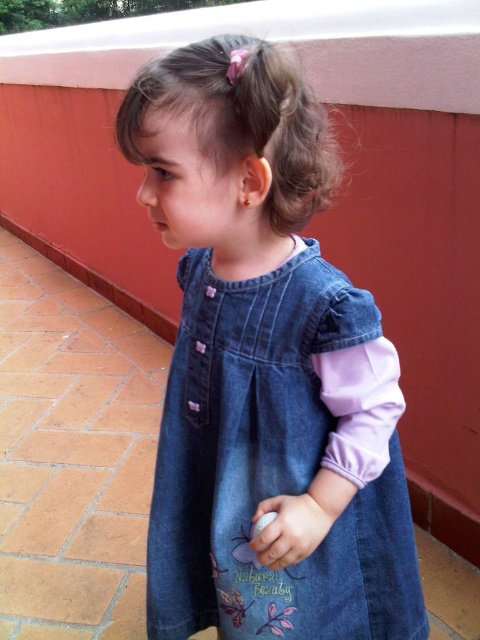
Question: Which point is farther to the camera?

Choices:
 (A) (303, 528)
 (B) (286, 83)
 (C) (231, 99)

Answer: (A)

Question: Which point is farther from the camera taking this photo?

Choices:
 (A) (301, 593)
 (B) (273, 508)
 (C) (276, 148)

Answer: (A)

Question: Which is nearer to the curly blonde hair at upper center?

Choices:
 (A) white matte ball at center
 (B) denim dress at center

Answer: (B)

Question: Does denim dress at center appear on the right side of white matte ball at center?

Choices:
 (A) no
 (B) yes

Answer: (A)

Question: Does denim dress at center have a lesser width compared to white matte ball at center?

Choices:
 (A) no
 (B) yes

Answer: (A)

Question: Is denim dress at center to the right of white matte ball at center from the viewer's perspective?

Choices:
 (A) yes
 (B) no

Answer: (B)